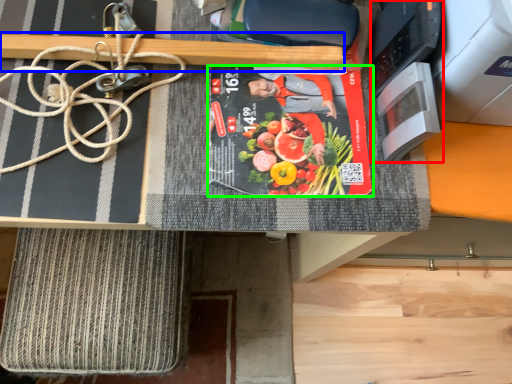
Question: Considering the real-world distances, which object is closest to appliance (highlighted by a red box)? wood (highlighted by a blue box) or paperback book (highlighted by a green box).

Choices:
 (A) wood
 (B) paperback book

Answer: (B)